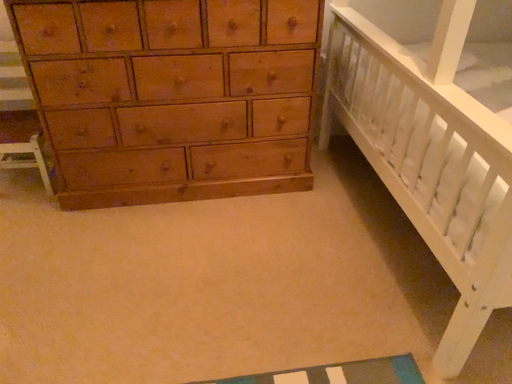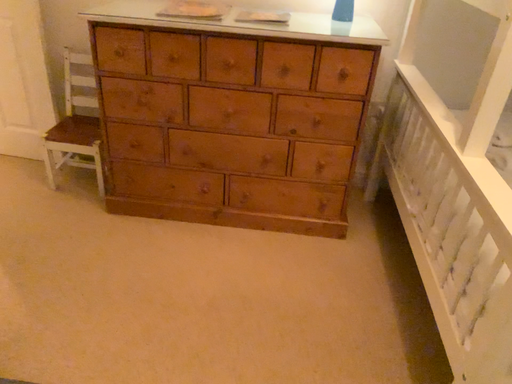
Question: Which way did the camera rotate in the video?

Choices:
 (A) rotated left
 (B) rotated right

Answer: (A)